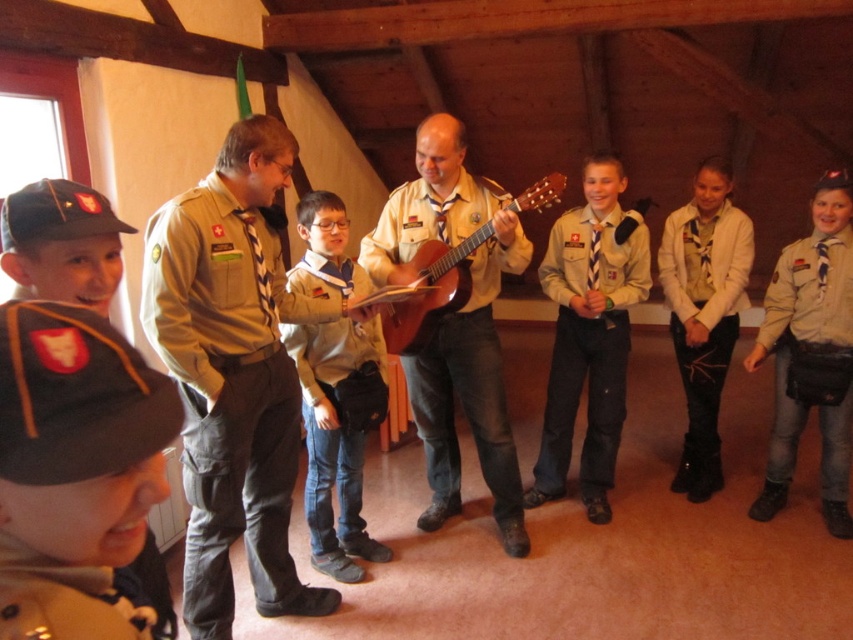
You are organizing a photo shoot in this room and need to position two props. One prop must be placed exactly where the khaki uniform cap at lower left is, and the other where the white matte jacket at center is. If the props are 10 feet long each, will they overlap when placed end to end between these two points?

The distance between the khaki uniform cap at lower left and the white matte jacket at center is 9.10 feet. Since each prop is 10 feet long, placing them end to end would total 20 feet, which is longer than the 9.10 feet between them. Therefore, the props will overlap when placed end to end between these two points.

Looking at this image, in the scene described, there are two central figures wearing a khaki uniform at center and a light gray fleece sweater at center. From the perspective of someone facing the scene, which clothing item is positioned to the left?

The khaki uniform at center is to the left of the light gray fleece sweater at center.